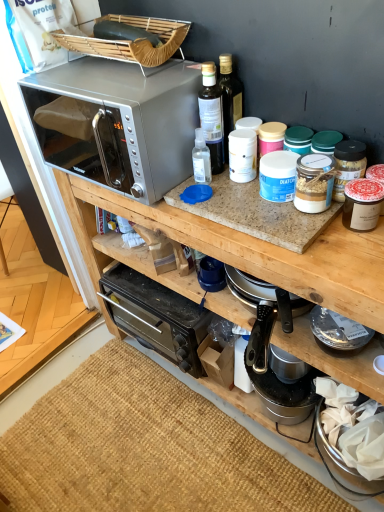
Locate an element on the screen. empty space that is ontop of satin silver microwave at upper left (from a real-world perspective) is located at coordinates (107, 75).